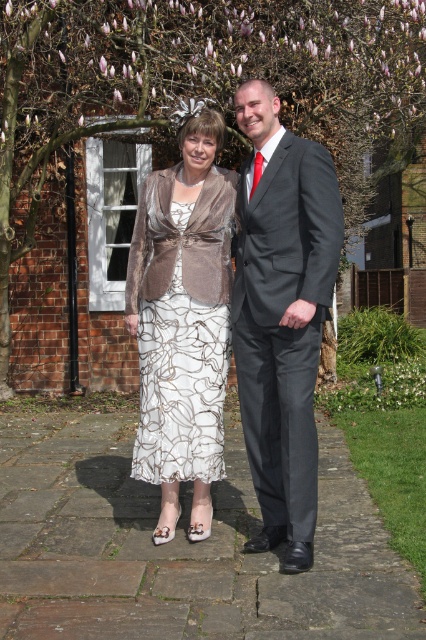
This screenshot has height=640, width=426. What do you see at coordinates (198, 88) in the screenshot?
I see `smooth bark tree at upper center` at bounding box center [198, 88].

Which is below, smooth bark tree at upper center or matte silver dress at center?

matte silver dress at center

Is point (106, 83) positioned after point (209, 200)?

That is True.

I want to click on smooth bark tree at upper center, so click(198, 88).

Is point (112, 35) closer to viewer compared to point (241, 365)?

No, it is behind (241, 365).

Where is `smooth bark tree at upper center`? smooth bark tree at upper center is located at coordinates (198, 88).

Identify the location of smooth bark tree at upper center. (198, 88).

Does dark gray suit at center appear over matte silver dress at center?

Correct, dark gray suit at center is located above matte silver dress at center.

Who is higher up, dark gray suit at center or matte silver dress at center?

dark gray suit at center is higher up.

This screenshot has height=640, width=426. In order to click on dark gray suit at center in this screenshot , I will do `click(282, 316)`.